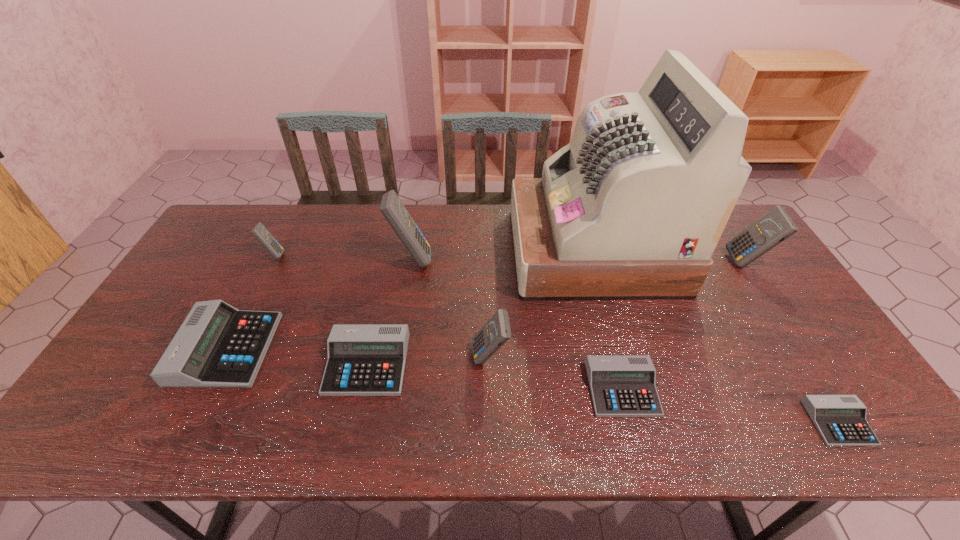
Locate an element on the screen. the biggest gray calculator is located at coordinates [x=217, y=346].

Find the location of a particular element. This screenshot has width=960, height=540. the third shortest object is located at coordinates (363, 359).

Locate an element on the screen. This screenshot has width=960, height=540. the sixth tallest calculator is located at coordinates (363, 359).

Find the location of `the third gray calculator from left to right`. the third gray calculator from left to right is located at coordinates (x=621, y=385).

Where is `the second smallest gray calculator`? the second smallest gray calculator is located at coordinates (621, 385).

You are a GUI agent. You are given a task and a screenshot of the screen. Output one action in this format:
    pyautogui.click(x=<x>, y=<y>)
    Task: Click on the shortest object
    The width and height of the screenshot is (960, 540).
    Given the screenshot: What is the action you would take?
    pyautogui.click(x=840, y=420)

Identify the location of the rightmost gray calculator. (840, 420).

Where is `vacant space located on the operating side of the tallest object`? vacant space located on the operating side of the tallest object is located at coordinates (495, 251).

You are a GUI agent. You are given a task and a screenshot of the screen. Output one action in this format:
    pyautogui.click(x=<x>, y=<y>)
    Task: Click on the vacant region located 0.100m on the operating side of the tallest object
    
    Given the screenshot: What is the action you would take?
    pyautogui.click(x=483, y=251)

The height and width of the screenshot is (540, 960). Identify the location of blank space located 0.130m on the operating side of the tallest object. (473, 251).